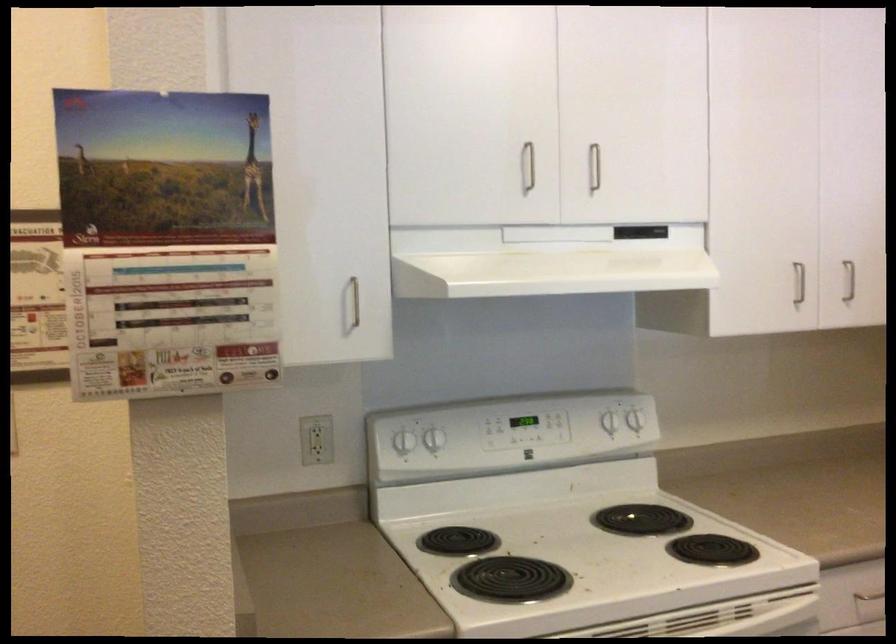
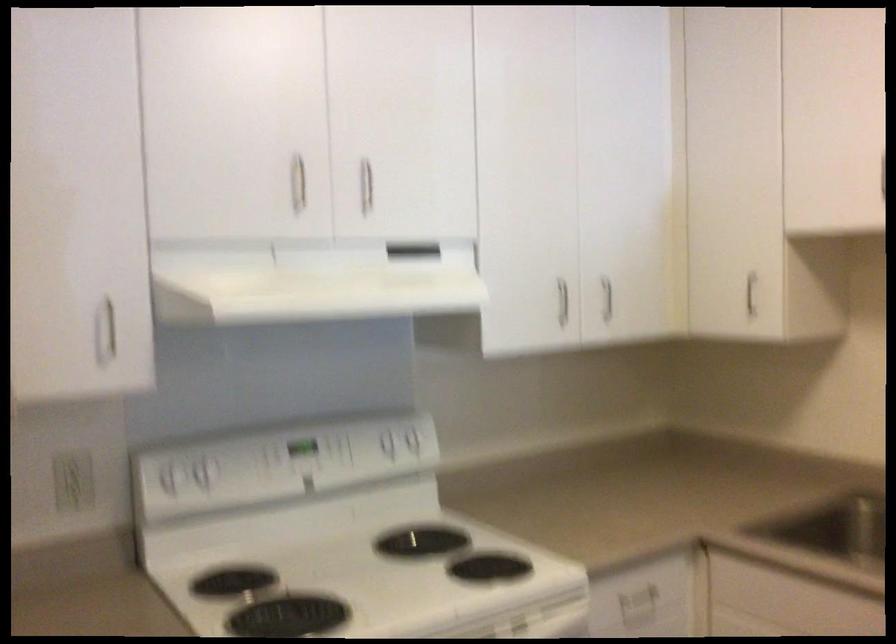
Question: Which direction would the cameraman need to move to produce the second image? Reply with the corresponding letter.

Choices:
 (A) Left
 (B) Right
 (C) Forward
 (D) Backward

Answer: (B)